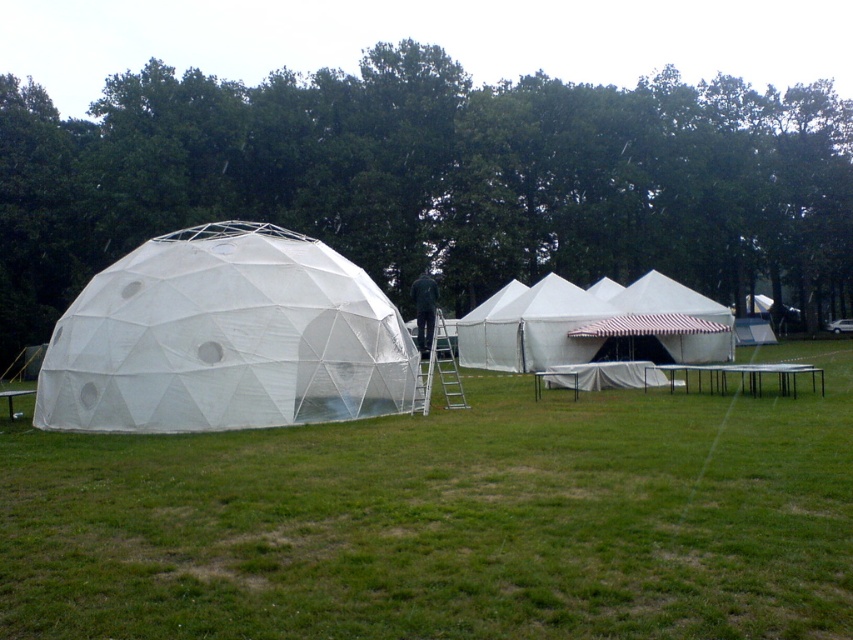
Question: Where is green leafy tree at upper center located in relation to white fabric dome at left in the image?

Choices:
 (A) left
 (B) right

Answer: (B)

Question: Does green grass at lower center have a smaller size compared to white canvas tent at center?

Choices:
 (A) no
 (B) yes

Answer: (B)

Question: Which point is farther to the camera?

Choices:
 (A) (160, 310)
 (B) (780, 272)
 (C) (502, 392)
 (D) (717, 332)

Answer: (B)

Question: Is green grass at lower center below white fabric dome at left?

Choices:
 (A) yes
 (B) no

Answer: (A)

Question: Based on their relative distances, which object is nearer to the white fabric dome at left?

Choices:
 (A) white canvas tent at center
 (B) green grass at lower center
 (C) green leafy tree at upper center

Answer: (B)

Question: Which point is farther to the camera?

Choices:
 (A) (228, 141)
 (B) (381, 568)
 (C) (364, 285)
 (D) (566, 310)

Answer: (A)